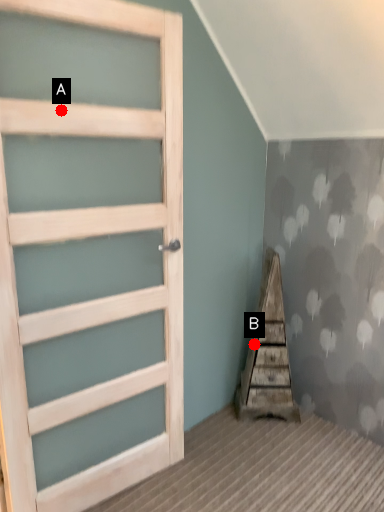
Question: Two points are circled on the image, labeled by A and B beside each circle. Which of the following is the farthest from the observer?

Choices:
 (A) A is further
 (B) B is further

Answer: (B)